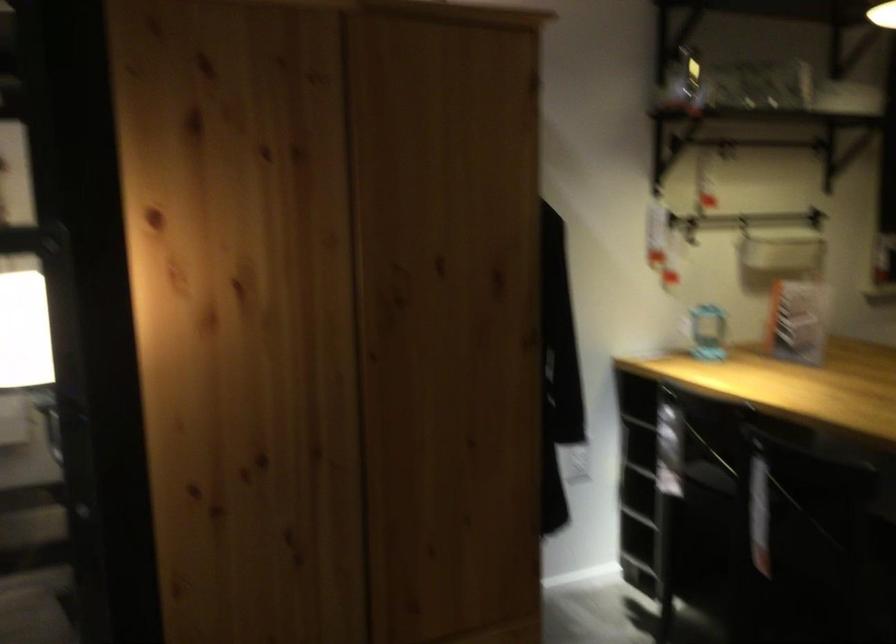
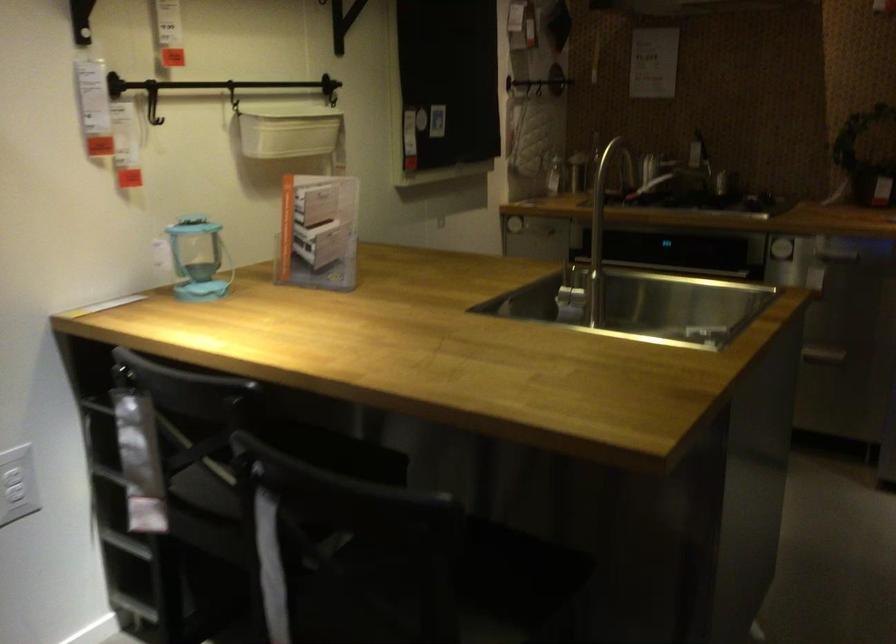
In the second image, find the point that corresponds to (x=822, y=314) in the first image.

(317, 232)